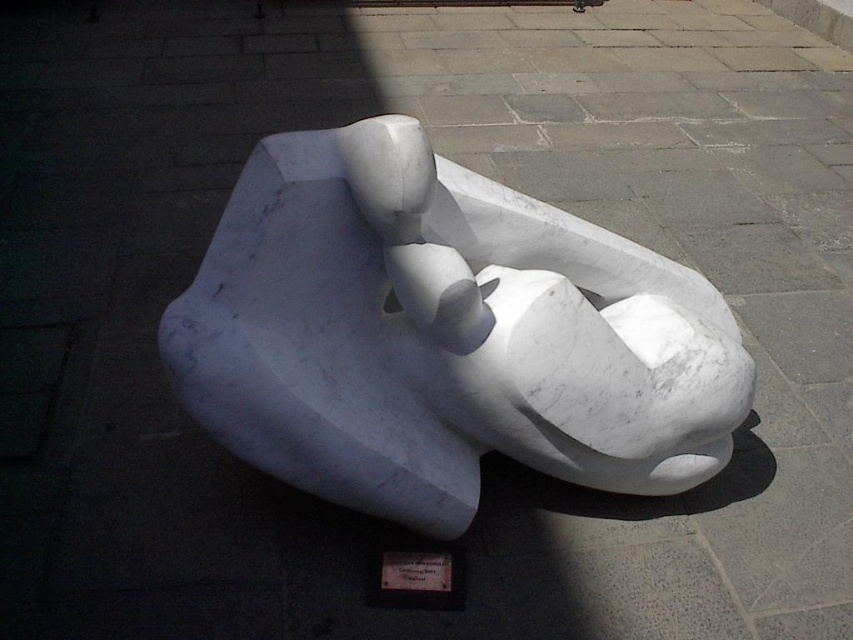
Question: Which point appears closest to the camera in this image?

Choices:
 (A) (395, 552)
 (B) (694, 352)

Answer: (B)

Question: Is white marble sculpture at center closer to camera compared to wooden plaque at center?

Choices:
 (A) no
 (B) yes

Answer: (B)

Question: Does white marble sculpture at center appear on the right side of wooden plaque at center?

Choices:
 (A) no
 (B) yes

Answer: (B)

Question: Is white marble sculpture at center bigger than wooden plaque at center?

Choices:
 (A) no
 (B) yes

Answer: (B)